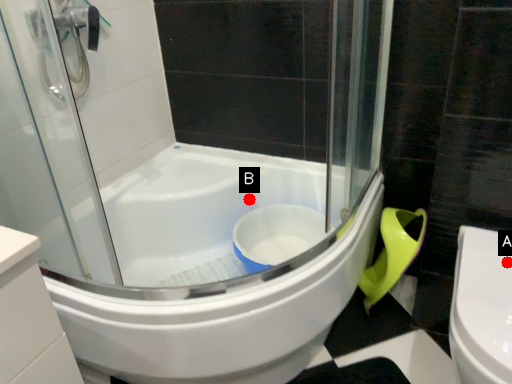
Question: Two points are circled on the image, labeled by A and B beside each circle. Which of the following is the closest to the observer?

Choices:
 (A) A is closer
 (B) B is closer

Answer: (A)